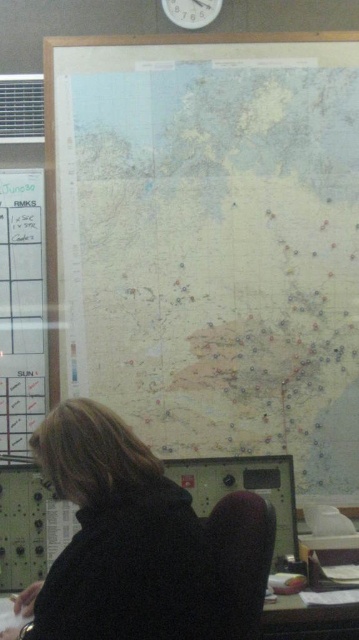
Looking at this image, you are organizing a desk and need to place a new item between the white paper at left and the white plastic clock at upper center. Which object should you place the new item closer to if it requires more space horizontally?

You should place the new item closer to the white plastic clock at upper center because it has a greater width than the white paper at left, meaning there is more horizontal space available near it.